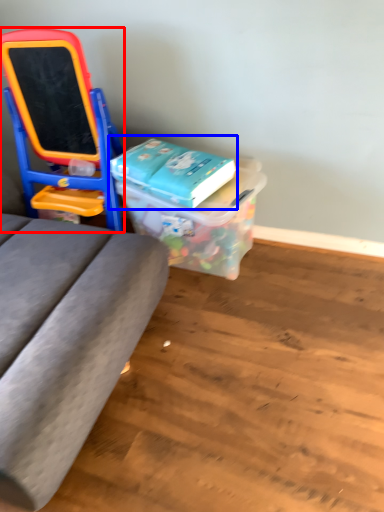
Question: Which object is closer to the camera taking this photo, furniture (highlighted by a red box) or book (highlighted by a blue box)?

Choices:
 (A) furniture
 (B) book

Answer: (A)